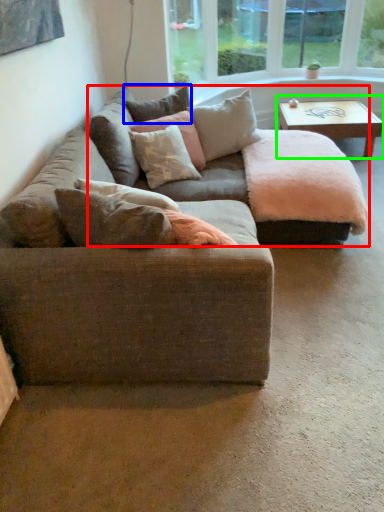
Question: Considering the real-world distances, which object is farthest from couch (highlighted by a red box)? pillow (highlighted by a blue box) or coffee table (highlighted by a green box)?

Choices:
 (A) pillow
 (B) coffee table

Answer: (B)